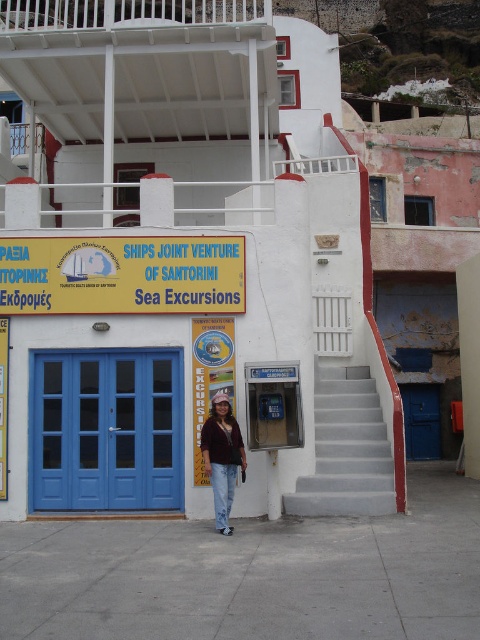
Is yellow plastic sign at center to the right of denim jacket at center from the viewer's perspective?

No, yellow plastic sign at center is not to the right of denim jacket at center.

Who is more forward, (x=206, y=237) or (x=220, y=412)?

Positioned in front is point (x=220, y=412).

Image resolution: width=480 pixels, height=640 pixels. Describe the element at coordinates (121, 275) in the screenshot. I see `yellow plastic sign at center` at that location.

Where is `yellow plastic sign at center`? This screenshot has width=480, height=640. yellow plastic sign at center is located at coordinates click(x=121, y=275).

Does yellow plastic sign at center have a larger size compared to gray concrete stairs at center?

No.

Can you confirm if yellow plastic sign at center is positioned to the right of gray concrete stairs at center?

No, yellow plastic sign at center is not to the right of gray concrete stairs at center.

Does point (168, 294) lie behind point (360, 440)?

No, it is in front of (360, 440).

Where is `yellow plastic sign at center`? This screenshot has width=480, height=640. yellow plastic sign at center is located at coordinates (121, 275).

Is blue matte door at lower left below yellow plastic sign at center?

Indeed, blue matte door at lower left is positioned under yellow plastic sign at center.

The width and height of the screenshot is (480, 640). In order to click on blue matte door at lower left in this screenshot , I will do `click(107, 432)`.

Is point (115, 381) closer to viewer compared to point (106, 243)?

Yes, point (115, 381) is in front of point (106, 243).

At what (x,y) coordinates should I click in order to perform the action: click on blue matte door at lower left. Please return your answer as a coordinate pair (x, y). This screenshot has height=640, width=480. Looking at the image, I should click on (107, 432).